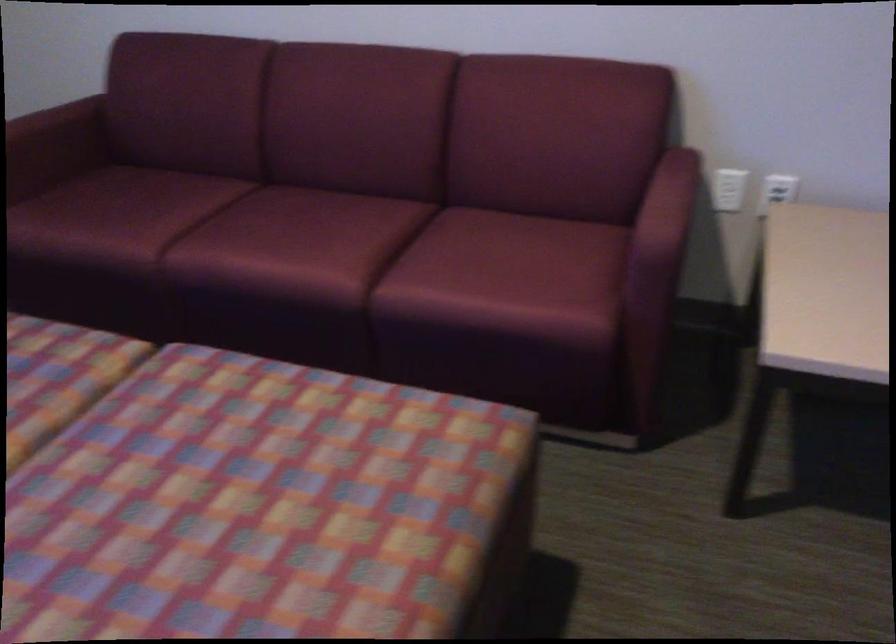
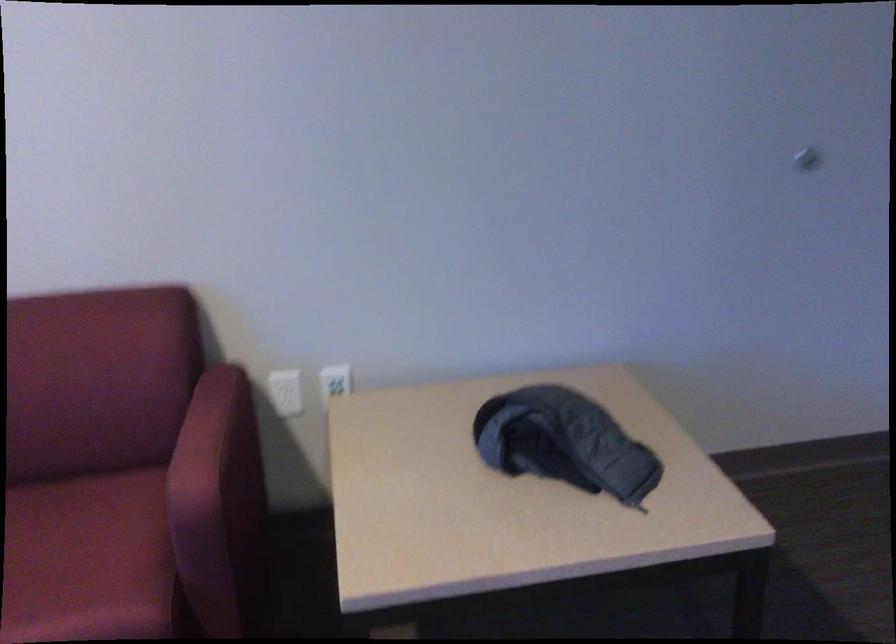
Question: Based on the continuous images, in which direction is the camera rotating? Reply with the corresponding letter.

Choices:
 (A) Left
 (B) Right
 (C) Up
 (D) Down

Answer: (B)